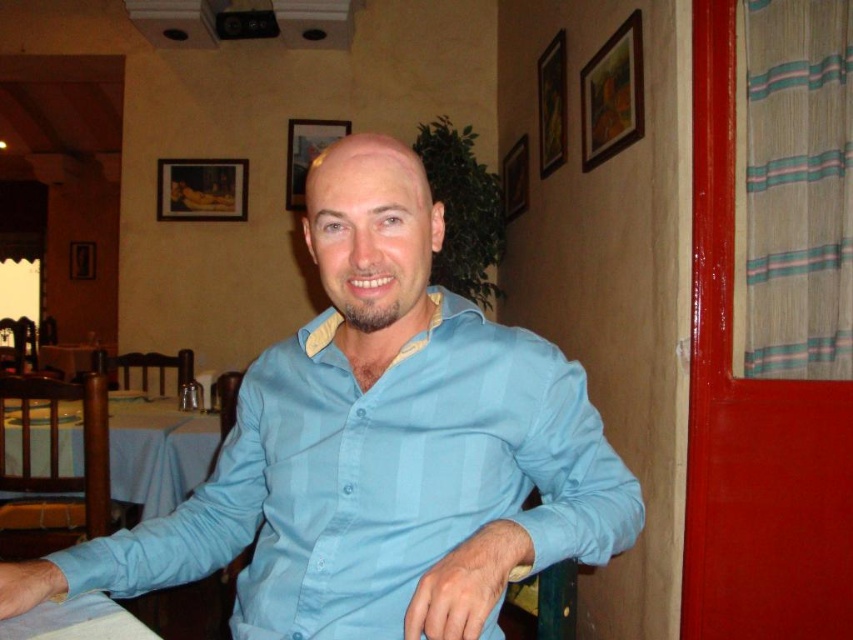
Is the position of light blue striped shirt at center more distant than that of white fabric table at lower left?

No, light blue striped shirt at center is closer to the viewer.

Locate an element on the screen. The height and width of the screenshot is (640, 853). light blue striped shirt at center is located at coordinates (383, 445).

Where is `light blue striped shirt at center`? This screenshot has width=853, height=640. light blue striped shirt at center is located at coordinates (383, 445).

Between blue fabric table at lower left and white fabric table at lower left, which one appears on the left side from the viewer's perspective?

From the viewer's perspective, blue fabric table at lower left appears more on the left side.

Locate an element on the screen. The image size is (853, 640). blue fabric table at lower left is located at coordinates (157, 451).

Does light blue striped shirt at center appear over blue fabric table at lower left?

Yes.

Is point (422, 552) farther from camera compared to point (163, 509)?

No.

This screenshot has width=853, height=640. Identify the location of light blue striped shirt at center. (383, 445).